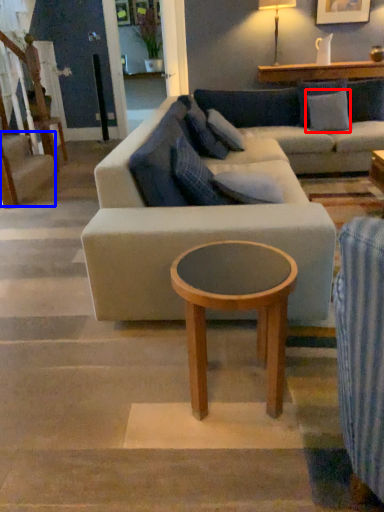
Question: Which of the following is the farthest to the observer, pillow (highlighted by a red box) or stairwell (highlighted by a blue box)?

Choices:
 (A) pillow
 (B) stairwell

Answer: (A)